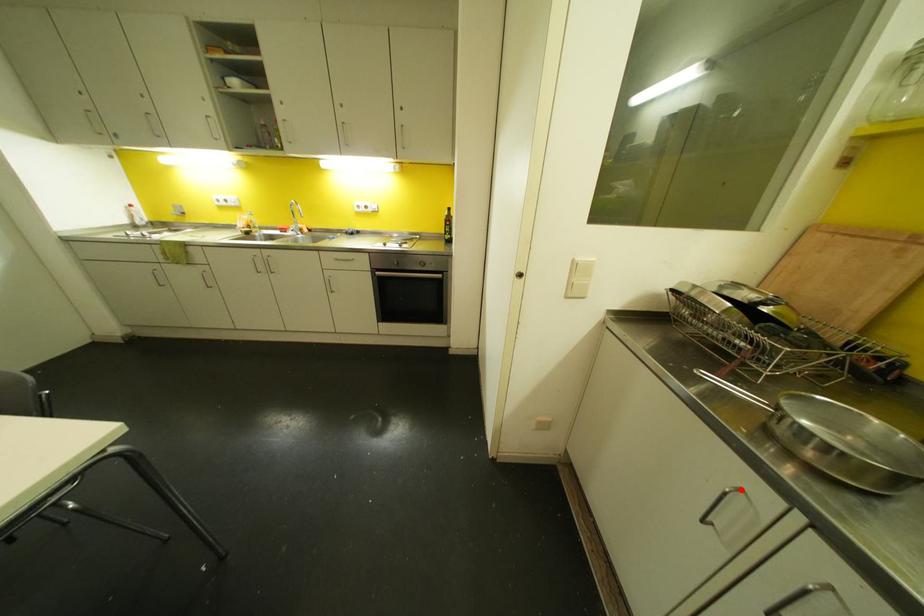
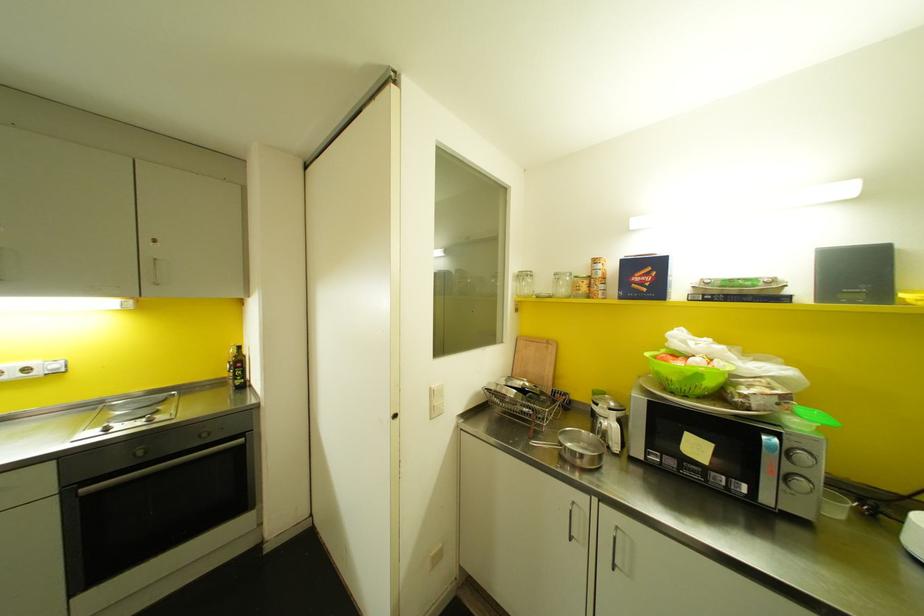
In the second image, find the point that corresponds to the highlighted location in the first image.

(573, 501)